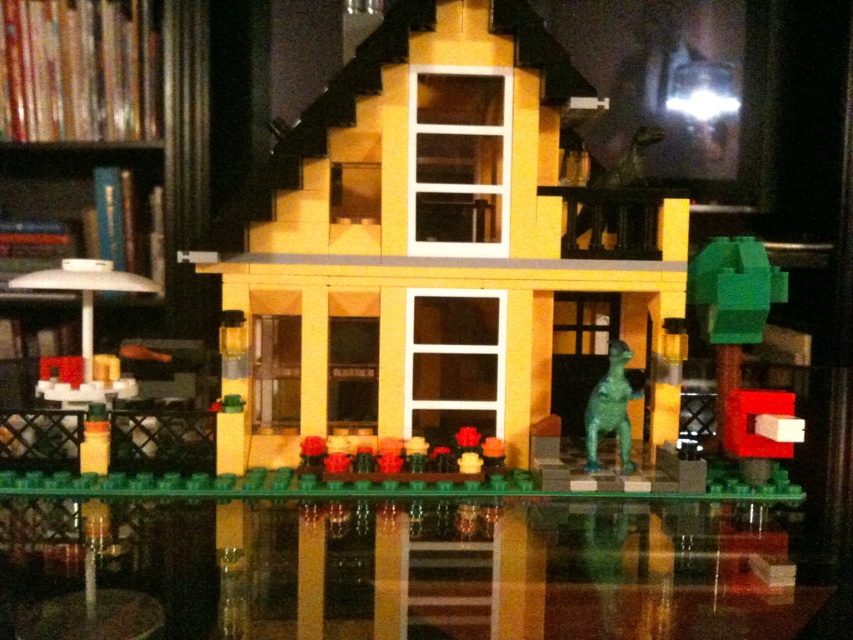
Can you confirm if transparent glass table at lower center is thinner than white plastic bookshelf at left?

No.

Between point (364, 600) and point (47, 442), which one is positioned in front?

Positioned in front is point (364, 600).

Does point (619, 608) come farther from viewer compared to point (173, 224)?

That is False.

Locate an element on the screen. transparent glass table at lower center is located at coordinates click(398, 563).

Can you confirm if yellow matte house at center is shorter than transparent glass table at lower center?

In fact, yellow matte house at center may be taller than transparent glass table at lower center.

Does yellow matte house at center have a greater height compared to transparent glass table at lower center?

Yes, yellow matte house at center is taller than transparent glass table at lower center.

Between point (419, 320) and point (97, 618), which one is positioned in front?

Point (97, 618) is in front.

Image resolution: width=853 pixels, height=640 pixels. I want to click on yellow matte house at center, so click(x=421, y=252).

Between point (498, 208) and point (102, 333), which one is positioned in front?

Positioned in front is point (498, 208).

Is yellow matte house at center wider than white plastic bookshelf at left?

Yes.

The image size is (853, 640). Find the location of `yellow matte house at center`. yellow matte house at center is located at coordinates (421, 252).